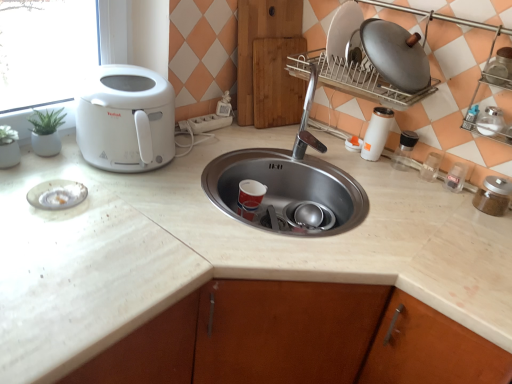
Find the location of a particular element. This screenshot has width=512, height=384. vacant space positioned to the left of white glossy thermos at right, the seventh appliance positioned from the right is located at coordinates (331, 145).